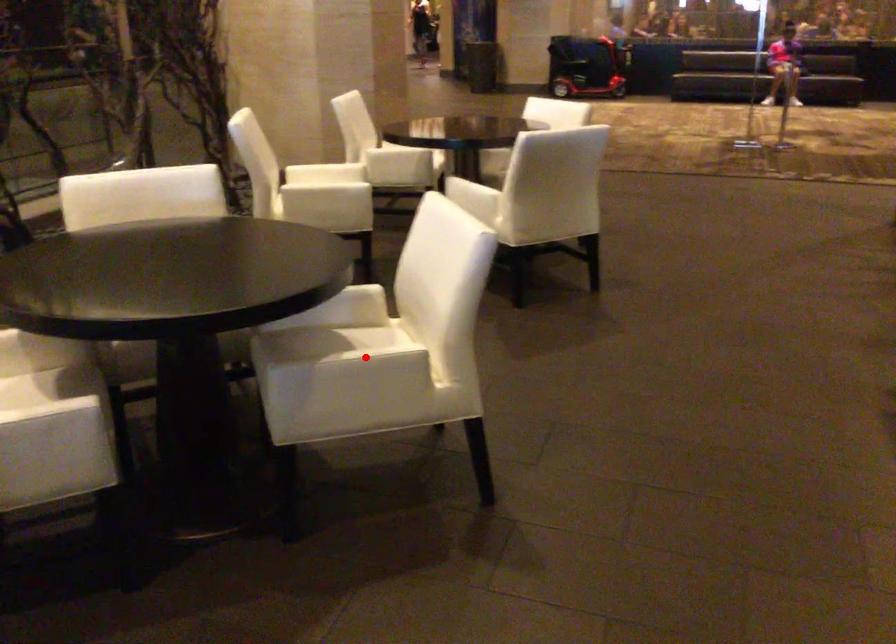
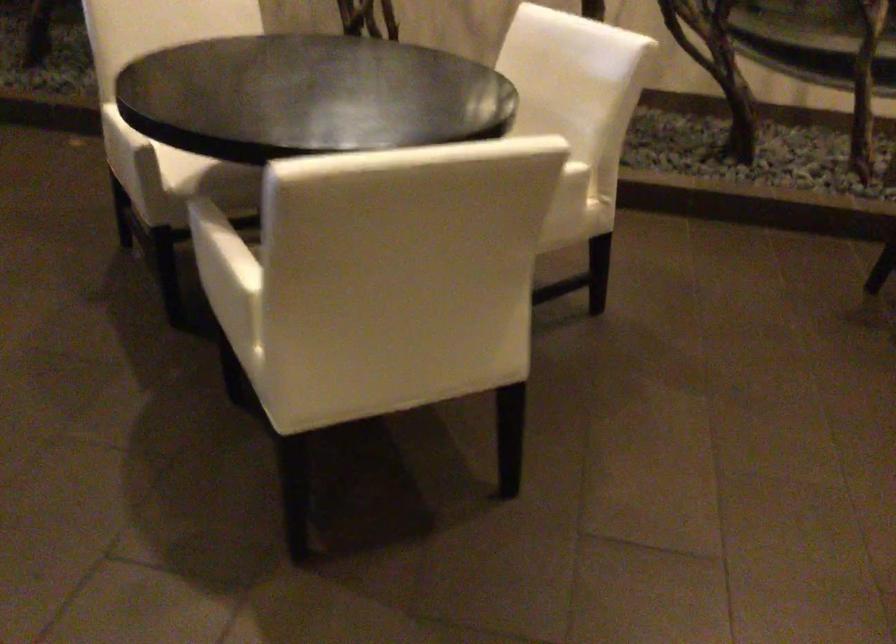
In the second image, find the point that corresponds to the highlighted location in the first image.

(220, 249)